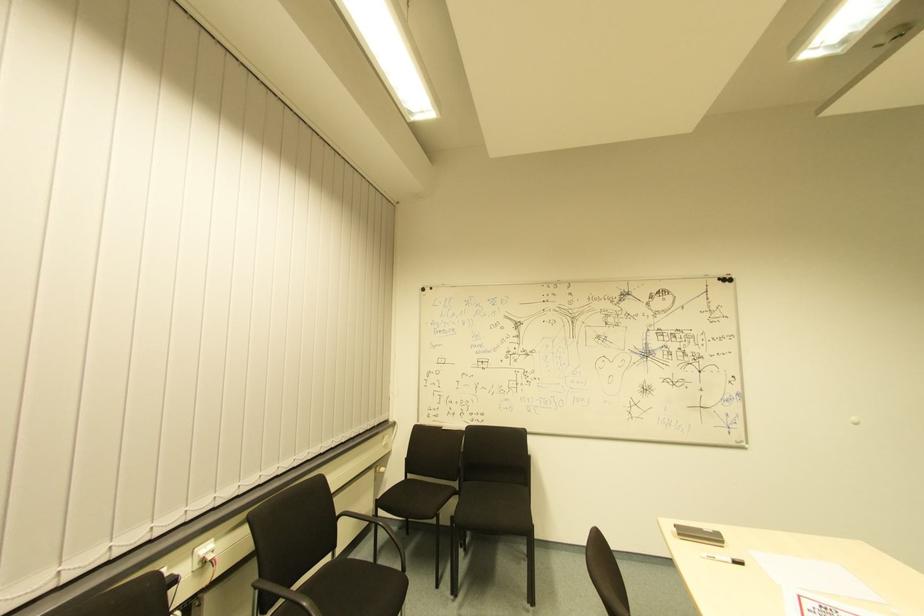
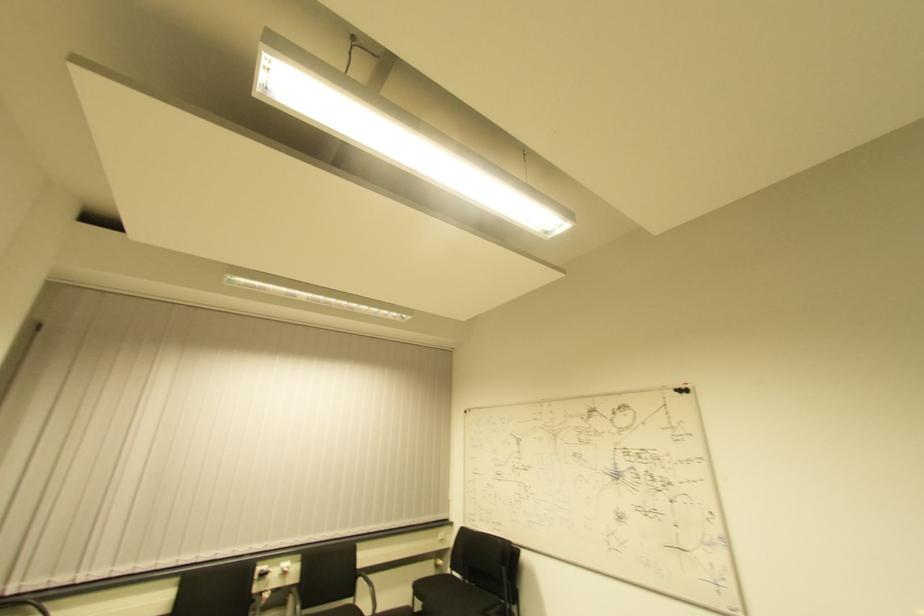
Find the pixel in the second image that matches (x=408, y=479) in the first image.

(454, 576)